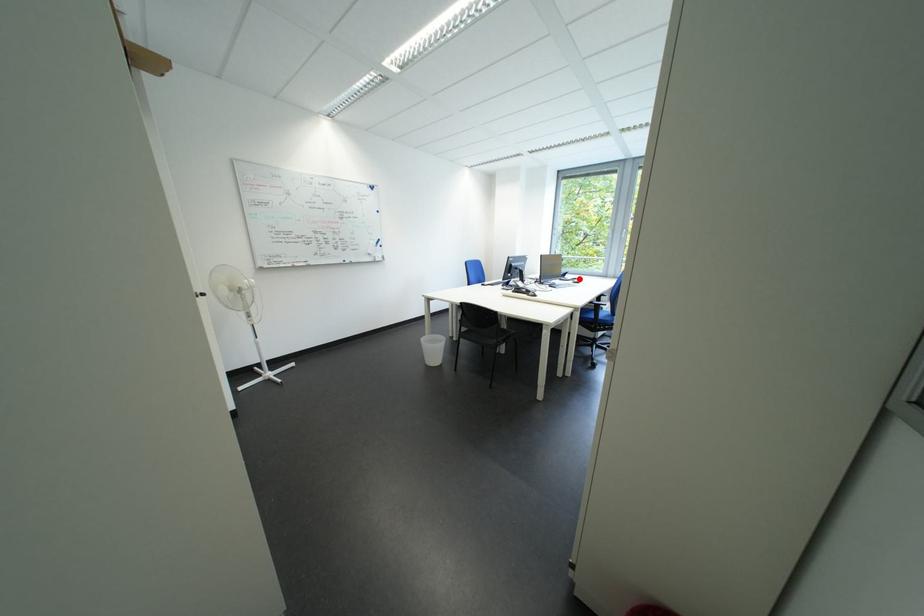
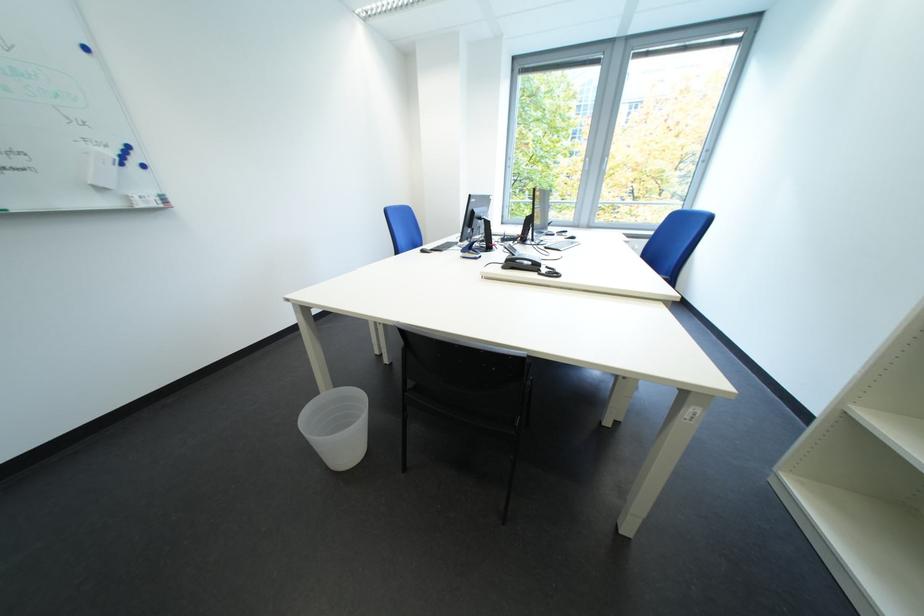
In the second image, find the point that corresponds to the highlighted location in the first image.

(563, 232)